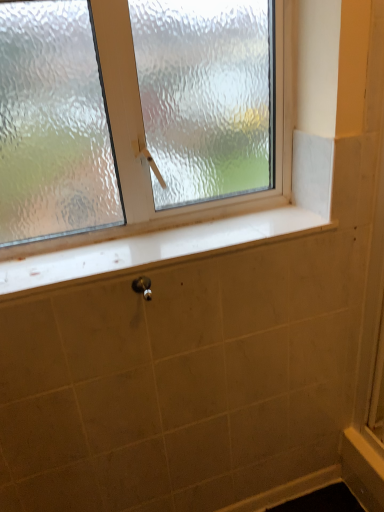
Question: Is white glossy window sill at center taller or shorter than metallic silver shower at lower center?

Choices:
 (A) short
 (B) tall

Answer: (A)

Question: Is white glossy window sill at center in front of or behind metallic silver shower at lower center in the image?

Choices:
 (A) behind
 (B) front

Answer: (B)

Question: Which of these objects is positioned closest to the white glossy window sill at center?

Choices:
 (A) metallic silver shower at lower center
 (B) frosted glass window at upper center

Answer: (B)

Question: Which is farther from the white glossy window sill at center?

Choices:
 (A) metallic silver shower at lower center
 (B) frosted glass window at upper center

Answer: (A)